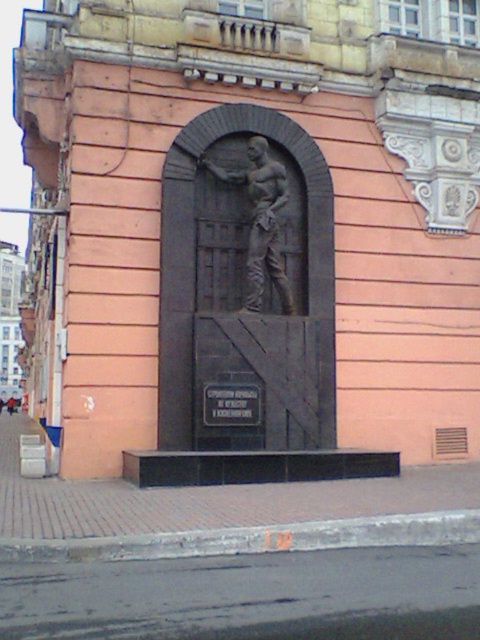
You are standing in front of a building with a sculptural relief. The relief is part of the building facade. Where exactly is the black stone relief at center positioned relative to the plaque below it?

The black stone relief at center is located above the plaque since it is positioned at point (247, 280), which is higher than the plaque below it.

You are an art student standing in front of the building and want to take a photo of both the gray stone statue at center and the black metal plaque at center. Which object should you focus on first to ensure both are in clear view?

You should focus on the gray stone statue at center first because it is closer to you than the black metal plaque at center, so focusing on it will also keep the plaque in focus if they are within the same focal range.